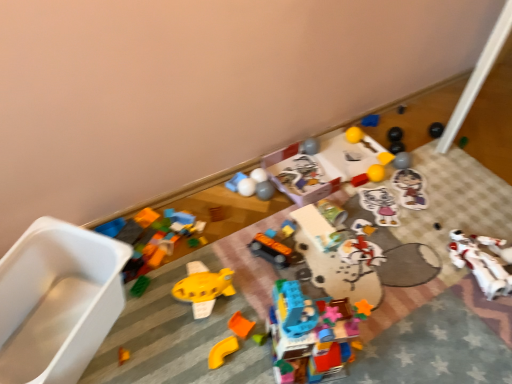
You are a GUI agent. You are given a task and a screenshot of the screen. Output one action in this format:
    pyautogui.click(x=<x>, y=<y>)
    Task: Click on the vacant space that is to the left of matte black car at center, the eighth toy positioned from the left
    This screenshot has height=384, width=512.
    Given the screenshot: What is the action you would take?
    pyautogui.click(x=234, y=258)